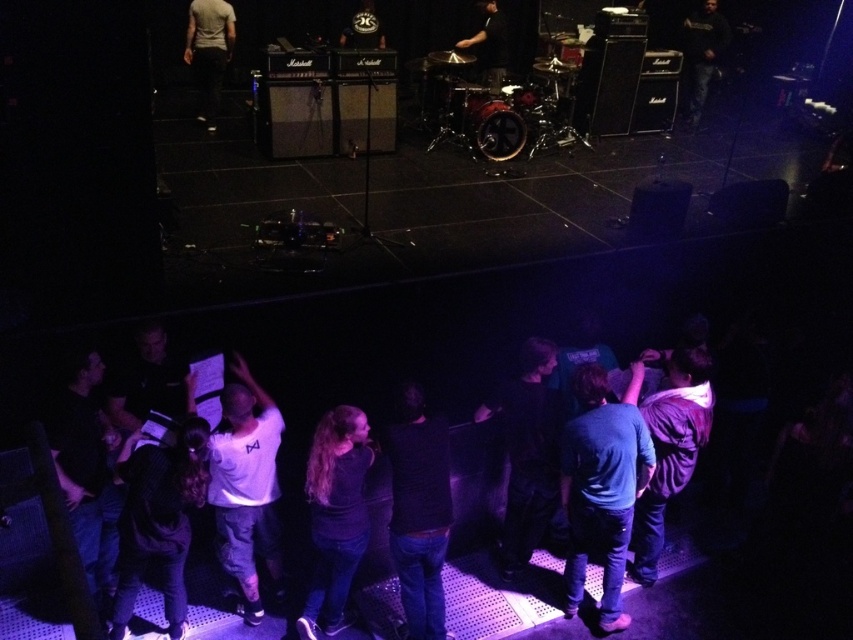
Question: Considering the relative positions of blue denim jeans at lower right and white matte shirt at upper left in the image provided, where is blue denim jeans at lower right located with respect to white matte shirt at upper left?

Choices:
 (A) right
 (B) left

Answer: (A)

Question: Does blue denim jeans at lower right appear on the left side of white matte shirt at upper left?

Choices:
 (A) no
 (B) yes

Answer: (A)

Question: From the image, what is the correct spatial relationship of blue denim jeans at lower right in relation to dark blue jeans at center?

Choices:
 (A) left
 (B) right

Answer: (B)

Question: Estimate the real-world distances between objects in this image. Which object is closer to the white matte shirt at center?

Choices:
 (A) dark gray hoodie at upper right
 (B) white matte shirt at upper left
 (C) purple fleece jacket at lower right

Answer: (C)

Question: Which object is positioned closest to the white matte shirt at upper left?

Choices:
 (A) dark gray hoodie at upper right
 (B) black matte shirt at lower left

Answer: (B)

Question: Which point is closer to the camera?

Choices:
 (A) (689, 70)
 (B) (210, 24)
 (C) (635, 456)
 (D) (442, 541)

Answer: (D)